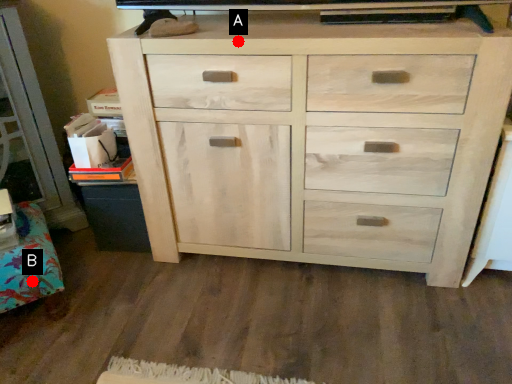
Question: Two points are circled on the image, labeled by A and B beside each circle. Which point is further to the camera?

Choices:
 (A) A is further
 (B) B is further

Answer: (B)